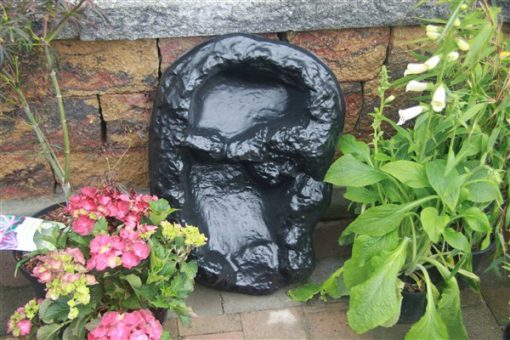
This screenshot has height=340, width=510. What are the coordinates of `wall` in the screenshot? It's located at (109, 99).